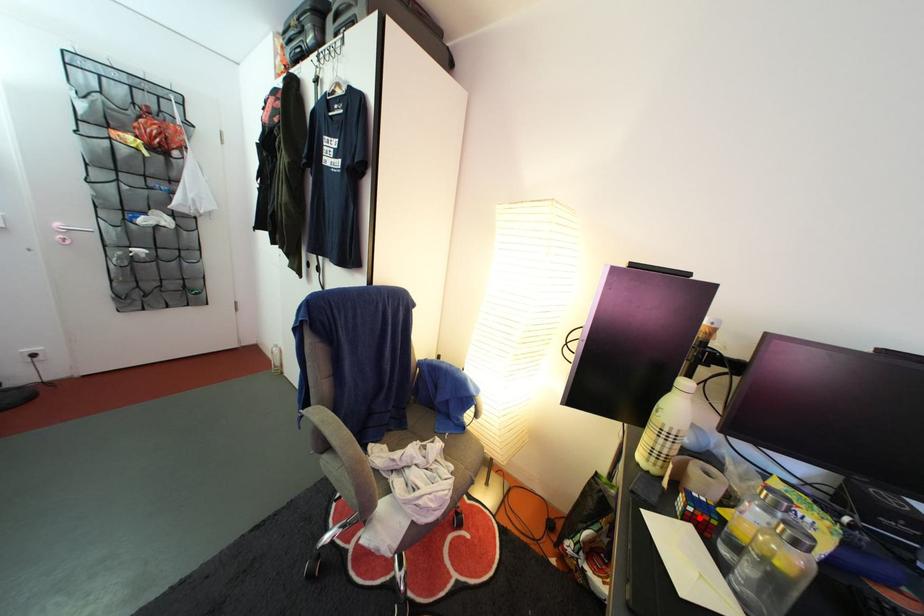
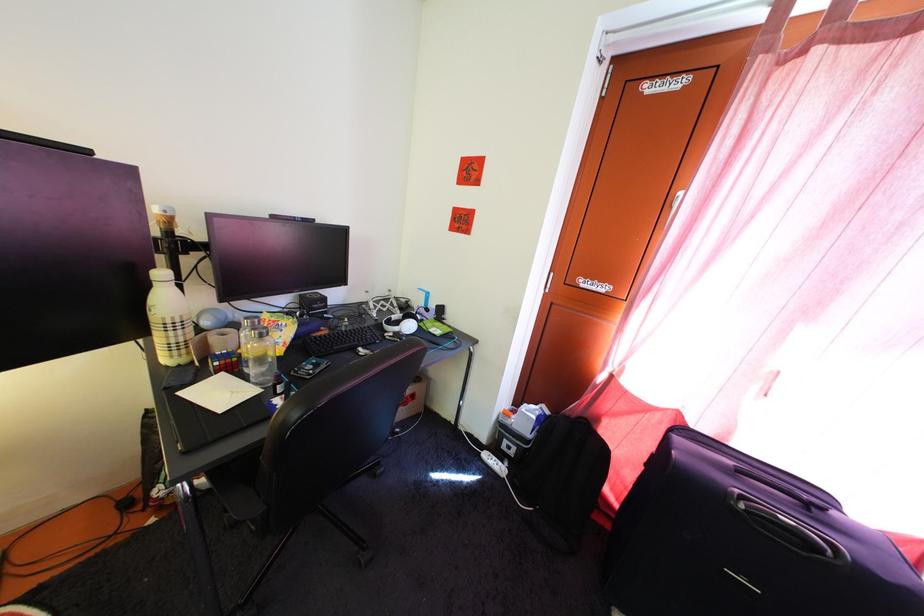
Locate, in the second image, the point that corresponds to the highlighted location in the first image.

(225, 371)